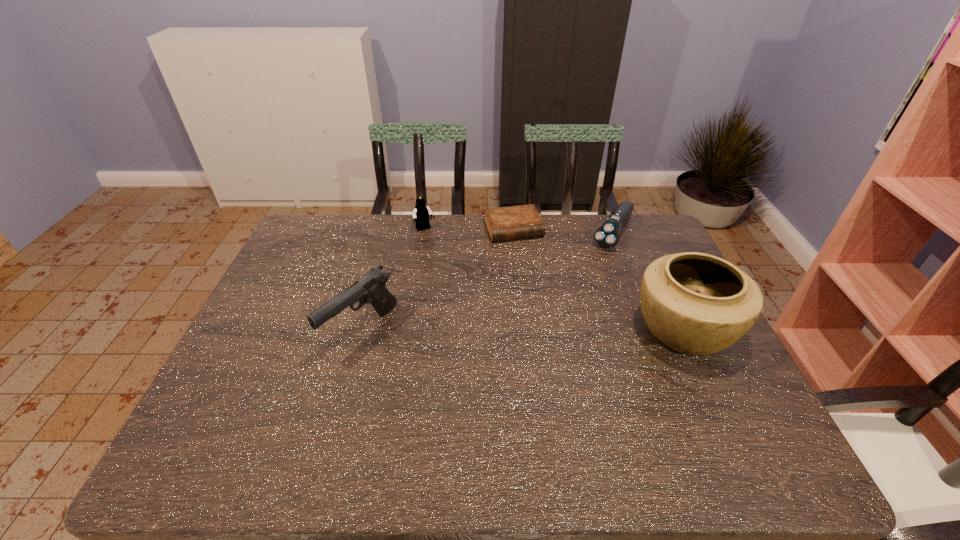
You are a GUI agent. You are given a task and a screenshot of the screen. Output one action in this format:
    pyautogui.click(x=<x>, y=<y>)
    Task: Click on the diary present at the far edge
    
    Given the screenshot: What is the action you would take?
    pyautogui.click(x=524, y=221)

Where is `Lego situated at the far edge`? The width and height of the screenshot is (960, 540). Lego situated at the far edge is located at coordinates (421, 213).

The width and height of the screenshot is (960, 540). What are the coordinates of `pottery that is at the right edge` in the screenshot? It's located at (698, 304).

This screenshot has height=540, width=960. Find the location of `electric shaver that is at the right edge`. electric shaver that is at the right edge is located at coordinates (607, 235).

You are a GUI agent. You are given a task and a screenshot of the screen. Output one action in this format:
    pyautogui.click(x=<x>, y=<y>)
    Task: Click on the object positioned at the far right corner
    
    Given the screenshot: What is the action you would take?
    [x=607, y=235]

Identify the location of vacant space at the far edge of the desktop. (583, 251).

This screenshot has height=540, width=960. Identify the location of vacant area at the near edge of the desktop. (390, 414).

At what (x,y) coordinates should I click in order to perform the action: click on free point at the left edge. Please return your answer as a coordinate pair (x, y). Looking at the image, I should click on (328, 272).

Where is `vacant point at the right edge`? vacant point at the right edge is located at coordinates (717, 364).

In the image, there is a desktop. Where is `blank space at the far left corner`? The image size is (960, 540). blank space at the far left corner is located at coordinates (324, 254).